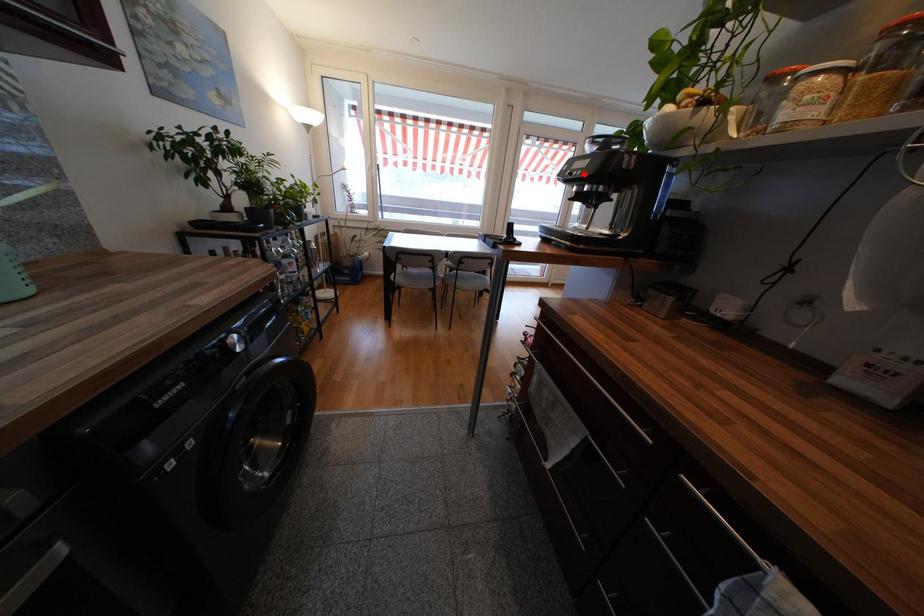
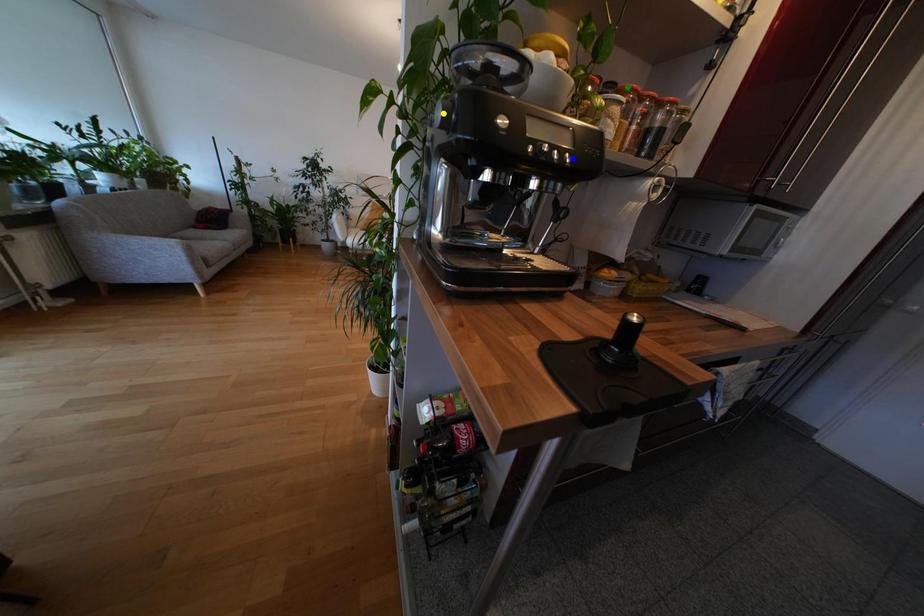
Question: I am providing you with two images of the same scene from different viewpoints. A red point is marked on the first image. You are given multiple points on the second image. Which mark in image 2 goes with the point in image 1?

Choices:
 (A) yellow point
 (B) green point
 (C) blue point

Answer: (C)